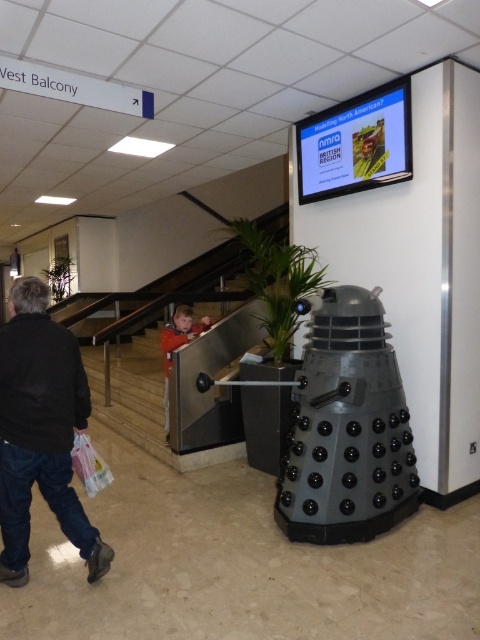
Question: Is the position of black matte jacket at lower left more distant than that of orange fleece jacket at lower center?

Choices:
 (A) yes
 (B) no

Answer: (B)

Question: From the image, what is the correct spatial relationship of black matte jacket at lower left in relation to orange fleece jacket at lower center?

Choices:
 (A) below
 (B) above

Answer: (A)

Question: Which point is closer to the camera?

Choices:
 (A) tap(41, 371)
 (B) tap(193, 323)

Answer: (A)

Question: Which point is closer to the camera?

Choices:
 (A) black matte jacket at lower left
 (B) orange fleece jacket at lower center

Answer: (A)

Question: Among these points, which one is farthest from the camera?

Choices:
 (A) tap(84, 547)
 (B) tap(183, 323)

Answer: (B)

Question: Is the position of black matte jacket at lower left more distant than that of orange fleece jacket at lower center?

Choices:
 (A) yes
 (B) no

Answer: (B)